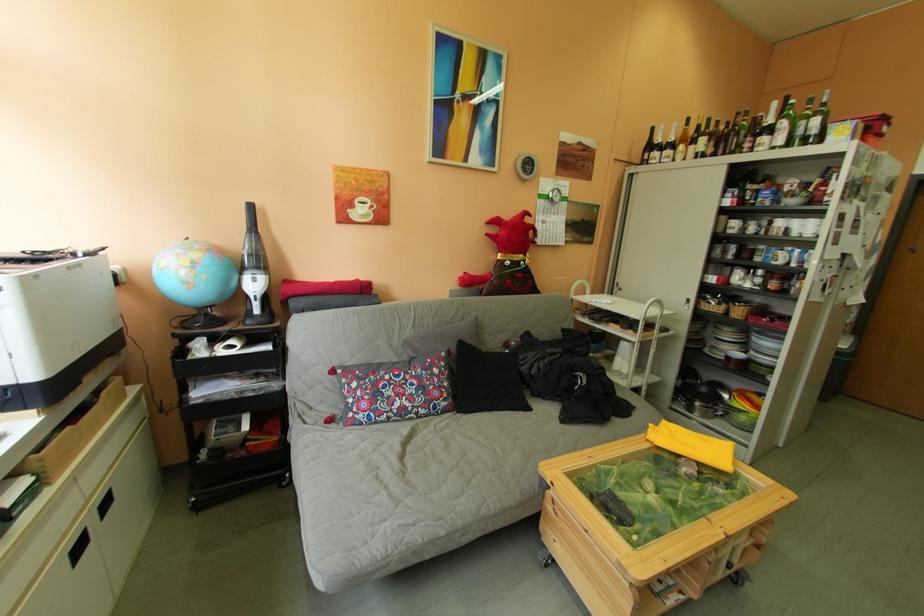
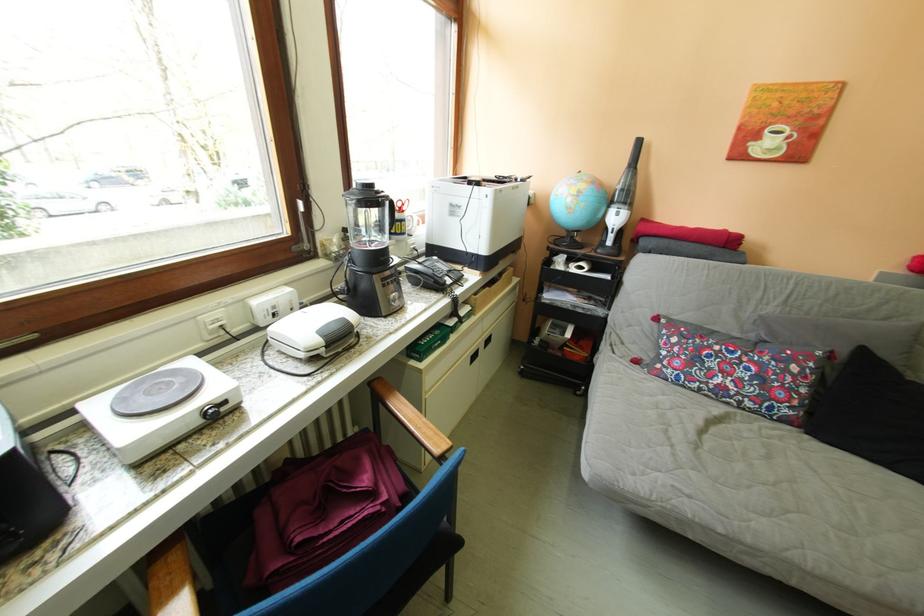
Find the pixel in the second image that matches point 419,479 in the first image.

(713, 455)